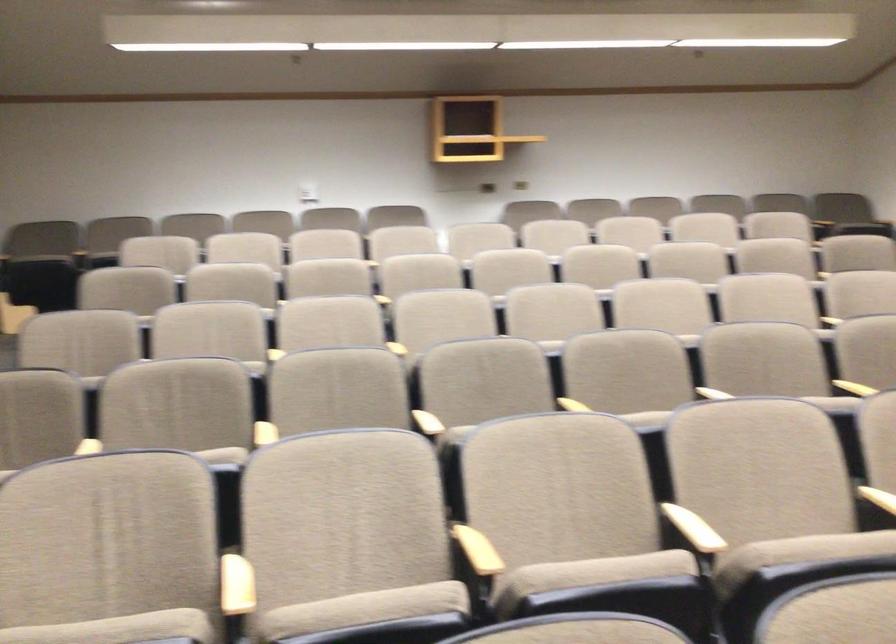
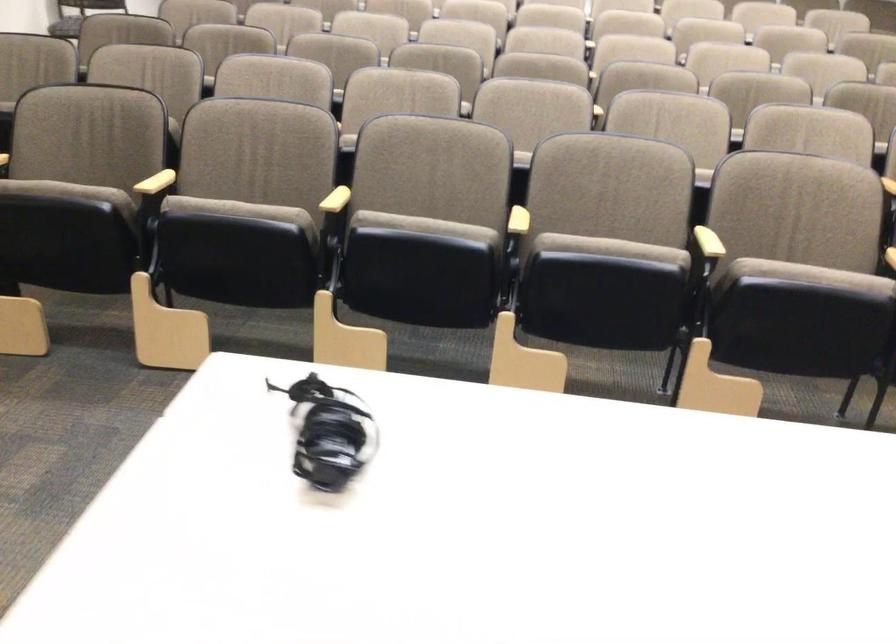
Question: I am providing you with two images of the same scene from different viewpoints. Which of the following objects are not visible in image2?

Choices:
 (A) wooden chair armrest
 (B) beige chair sitting surface
 (C) chair sitting surface
 (D) orange cap glue stick

Answer: (B)